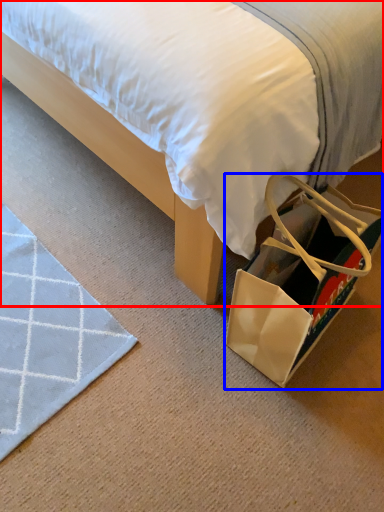
Question: Which point is further to the camera, bed (highlighted by a red box) or shoulder bag (highlighted by a blue box)?

Choices:
 (A) bed
 (B) shoulder bag

Answer: (B)